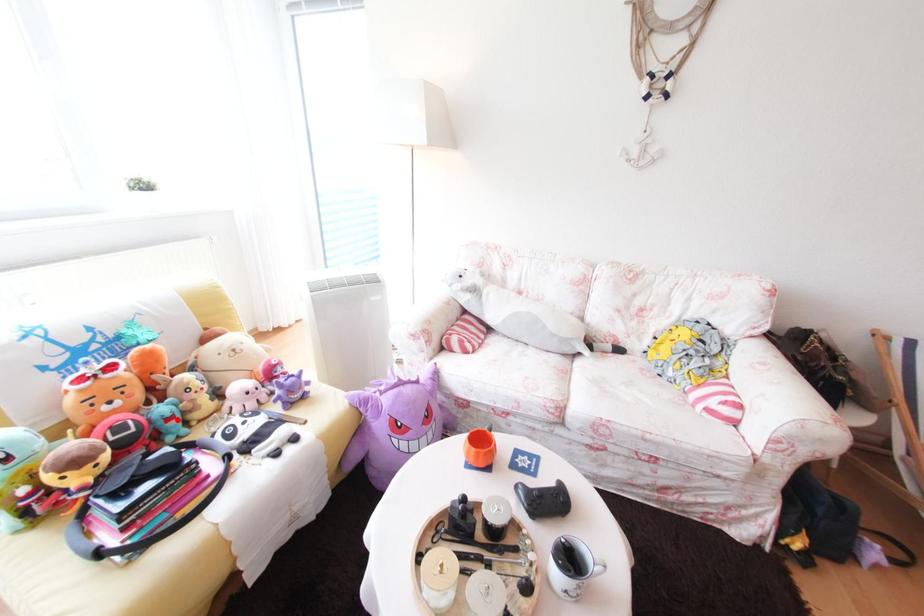
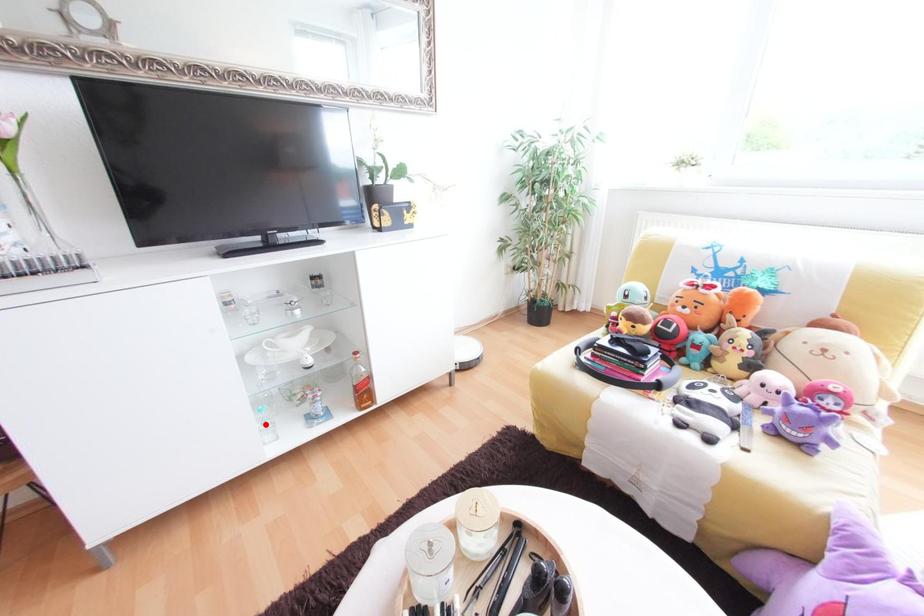
I am providing you with two images of the same scene from different viewpoints. A red point is marked on the first image and another point is marked on the second image. Is the red point in image1 aligned with the point shown in image2?

No